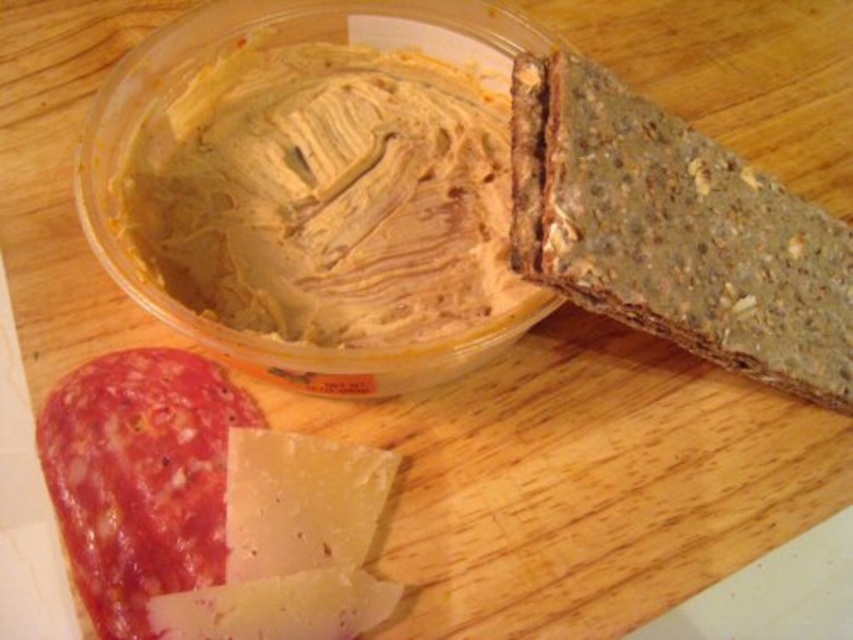
Can you confirm if dark brown textured bread at upper right is positioned to the right of white crumbly cheese at lower left?

Indeed, dark brown textured bread at upper right is positioned on the right side of white crumbly cheese at lower left.

Does dark brown textured bread at upper right come in front of white crumbly cheese at lower left?

No, dark brown textured bread at upper right is behind white crumbly cheese at lower left.

Identify the location of dark brown textured bread at upper right. (675, 232).